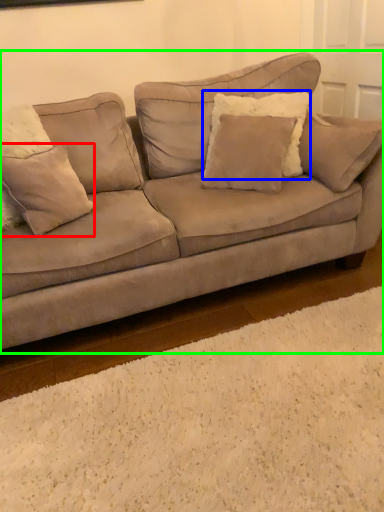
Question: Based on their relative distances, which object is farther from pillow (highlighted by a red box)? Choose from pillow (highlighted by a blue box) and studio couch (highlighted by a green box).

Choices:
 (A) pillow
 (B) studio couch

Answer: (A)